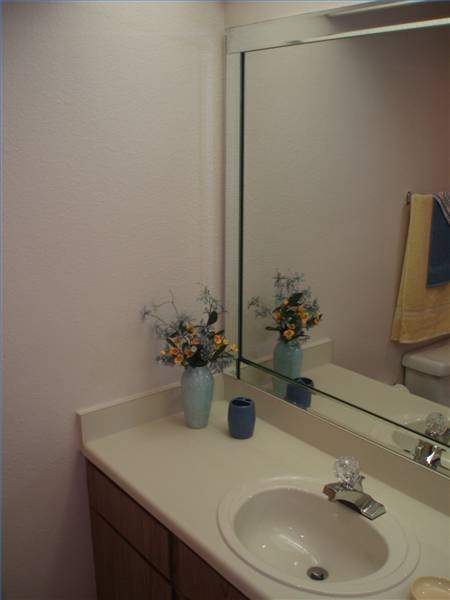
You are a GUI agent. You are given a task and a screenshot of the screen. Output one action in this format:
    pyautogui.click(x=<x>, y=<y>)
    Task: Click on the faucet
    
    Given the screenshot: What is the action you would take?
    pyautogui.click(x=338, y=493)